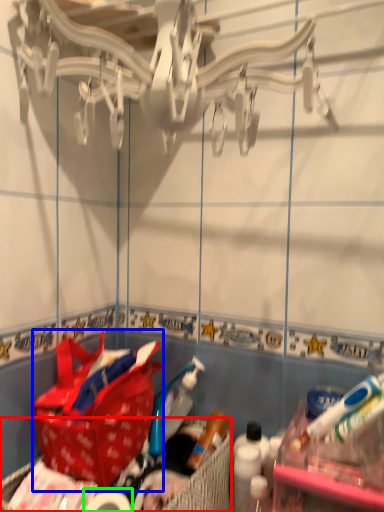
Question: Which is farther away from picnic basket (highlighted by a red box)? handbag (highlighted by a blue box) or toilet paper (highlighted by a green box)?

Choices:
 (A) handbag
 (B) toilet paper

Answer: (A)